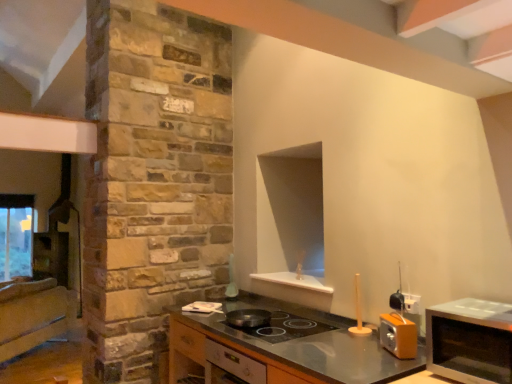
In order to face shiny black frying pan at center, should I rotate leftwards or rightwards?

You should rotate left by 0.945 degrees.

Identify the location of shiny black frying pan at center. This screenshot has width=512, height=384. pyautogui.click(x=248, y=318).

Measure the distance between satin silver stove at center, which ranks as the second cabinetry in back-to-front order, and camera.

satin silver stove at center, which ranks as the second cabinetry in back-to-front order, is 1.95 meters away from camera.

Measure the distance between satin silver microwave at right and camera.

4.40 feet.

Describe the element at coordinates (280, 348) in the screenshot. I see `metallic gray countertop at center` at that location.

What do you see at coordinates (30, 315) in the screenshot?
I see `wooden cabinet at left, the 2th cabinetry viewed from the right` at bounding box center [30, 315].

Find the location of a particular element. This screenshot has height=384, width=512. shiny black frying pan at center is located at coordinates (248, 318).

Is point (461, 317) closer or farther from the camera than point (174, 342)?

Point (461, 317).

Would you say satin silver microwave at right is outside satin silver stove at center, which is the second cabinetry from left to right?

Indeed, satin silver microwave at right is completely outside satin silver stove at center, which is the second cabinetry from left to right.

Which is more to the right, satin silver microwave at right or satin silver stove at center, which ranks as the second cabinetry in back-to-front order?

From the viewer's perspective, satin silver microwave at right appears more on the right side.

Considering the relative sizes of satin silver microwave at right and satin silver stove at center, acting as the first cabinetry starting from the right, in the image provided, is satin silver microwave at right wider than satin silver stove at center, acting as the first cabinetry starting from the right,?

In fact, satin silver microwave at right might be narrower than satin silver stove at center, acting as the first cabinetry starting from the right.

Between wooden cabinet at left, the 2th cabinetry in the front-to-back sequence, and satin silver microwave at right, which one has larger size?

With larger size is wooden cabinet at left, the 2th cabinetry in the front-to-back sequence.

From the image's perspective, is wooden cabinet at left, which ranks as the 1th cabinetry in back-to-front order, on satin silver microwave at right?

Actually, wooden cabinet at left, which ranks as the 1th cabinetry in back-to-front order, appears below satin silver microwave at right in the image.

Considering the sizes of objects wooden cabinet at left, which ranks as the 1th cabinetry in back-to-front order, and satin silver microwave at right in the image provided, who is shorter, wooden cabinet at left, which ranks as the 1th cabinetry in back-to-front order, or satin silver microwave at right?

Standing shorter between the two is satin silver microwave at right.

Which object is closer to the camera taking this photo, wooden cabinet at left, positioned as the first cabinetry in left-to-right order, or satin silver microwave at right?

satin silver microwave at right is closer to the camera.

Which is more to the right, satin silver microwave at right or wooden cabinet at left, the 2th cabinetry viewed from the right?

satin silver microwave at right is more to the right.

Is satin silver microwave at right placed right next to wooden cabinet at left, which ranks as the 1th cabinetry in back-to-front order?

satin silver microwave at right and wooden cabinet at left, which ranks as the 1th cabinetry in back-to-front order, are clearly separated.

From a real-world perspective, which object stands above the other?

satin silver microwave at right is physically above.

Does point (508, 343) come farther from viewer compared to point (25, 330)?

No, (508, 343) is in front of (25, 330).

Which object is wider, metallic gray countertop at center or satin silver stove at center, which ranks as the second cabinetry in back-to-front order?

metallic gray countertop at center is wider.

In the scene shown: Is metallic gray countertop at center taller than satin silver stove at center, acting as the first cabinetry starting from the right?

Correct, metallic gray countertop at center is much taller as satin silver stove at center, acting as the first cabinetry starting from the right.

Is metallic gray countertop at center not inside satin silver stove at center, which ranks as the second cabinetry in back-to-front order?

Absolutely, metallic gray countertop at center is external to satin silver stove at center, which ranks as the second cabinetry in back-to-front order.

How different are the orientations of metallic gray countertop at center and satin silver stove at center, which ranks as the second cabinetry in back-to-front order, in degrees?

They differ by 0.000206 degrees in their facing directions.

Which object is closer to the camera, satin silver microwave at right or metallic gray countertop at center?

satin silver microwave at right is more forward.

Is point (494, 345) farther from viewer compared to point (170, 380)?

No, it is in front of (170, 380).

Between satin silver microwave at right and metallic gray countertop at center, which one has smaller size?

satin silver microwave at right.

Who is taller, satin silver microwave at right or metallic gray countertop at center?

Standing taller between the two is metallic gray countertop at center.

Is shiny black frying pan at center wider or thinner than satin silver stove at center, placed as the 1th cabinetry when sorted from front to back?

Considering their sizes, shiny black frying pan at center looks slimmer than satin silver stove at center, placed as the 1th cabinetry when sorted from front to back.

Which is in front, shiny black frying pan at center or satin silver stove at center, acting as the first cabinetry starting from the right?

satin silver stove at center, acting as the first cabinetry starting from the right, is more forward.

From the image's perspective, is shiny black frying pan at center below satin silver stove at center, placed as the 1th cabinetry when sorted from front to back?

Incorrect, from the image's perspective, shiny black frying pan at center is higher than satin silver stove at center, placed as the 1th cabinetry when sorted from front to back.

In the scene shown: Is shiny black frying pan at center oriented towards satin silver stove at center, acting as the first cabinetry starting from the right?

No.

Which is farther, [207,368] or [51,324]?

The point [51,324] is farther.

In terms of height, does satin silver stove at center, which ranks as the second cabinetry in back-to-front order, look taller or shorter compared to wooden cabinet at left, the 2th cabinetry in the front-to-back sequence?

In the image, satin silver stove at center, which ranks as the second cabinetry in back-to-front order, appears to be shorter than wooden cabinet at left, the 2th cabinetry in the front-to-back sequence.

Which object is further away from the camera taking this photo, satin silver stove at center, acting as the first cabinetry starting from the right, or wooden cabinet at left, positioned as the first cabinetry in left-to-right order?

wooden cabinet at left, positioned as the first cabinetry in left-to-right order, is behind.

Considering the relative sizes of satin silver stove at center, which is the second cabinetry from left to right, and wooden cabinet at left, the 2th cabinetry in the front-to-back sequence, in the image provided, is satin silver stove at center, which is the second cabinetry from left to right, smaller than wooden cabinet at left, the 2th cabinetry in the front-to-back sequence,?

Yes.

This screenshot has height=384, width=512. I want to click on microwave that is on the right side of satin silver stove at center, which ranks as the second cabinetry in back-to-front order, so click(x=470, y=341).

Identify the location of microwave above the wooden cabinet at left, which ranks as the 1th cabinetry in back-to-front order (from a real-world perspective). click(470, 341).

When comparing their distances from shiny black frying pan at center, does satin silver microwave at right or metallic gray countertop at center seem closer?

Based on the image, metallic gray countertop at center appears to be nearer to shiny black frying pan at center.

When comparing their distances from metallic gray countertop at center, does satin silver microwave at right or shiny black frying pan at center seem closer?

Based on the image, shiny black frying pan at center appears to be nearer to metallic gray countertop at center.

From the image, which object appears to be nearer to wooden cabinet at left, which ranks as the 1th cabinetry in back-to-front order, metallic gray countertop at center or satin silver stove at center, which is the second cabinetry from left to right?

satin silver stove at center, which is the second cabinetry from left to right, lies closer to wooden cabinet at left, which ranks as the 1th cabinetry in back-to-front order, than the other object.

From the image, which object appears to be farther from wooden cabinet at left, the 2th cabinetry viewed from the right, satin silver microwave at right or metallic gray countertop at center?

Among the two, satin silver microwave at right is located further to wooden cabinet at left, the 2th cabinetry viewed from the right.

Considering their positions, is metallic gray countertop at center positioned further to satin silver microwave at right than shiny black frying pan at center?

Based on the image, shiny black frying pan at center appears to be further to satin silver microwave at right.

When comparing their distances from wooden cabinet at left, positioned as the first cabinetry in left-to-right order, does shiny black frying pan at center or satin silver stove at center, placed as the 1th cabinetry when sorted from front to back, seem further?

shiny black frying pan at center lies further to wooden cabinet at left, positioned as the first cabinetry in left-to-right order, than the other object.

From the image, which object appears to be nearer to metallic gray countertop at center, wooden cabinet at left, the 2th cabinetry viewed from the right, or satin silver stove at center, acting as the first cabinetry starting from the right?

Among the two, satin silver stove at center, acting as the first cabinetry starting from the right, is located nearer to metallic gray countertop at center.

Estimate the real-world distances between objects in this image. Which object is closer to wooden cabinet at left, which ranks as the 1th cabinetry in back-to-front order, satin silver stove at center, which is the second cabinetry from left to right, or metallic gray countertop at center?

The object closer to wooden cabinet at left, which ranks as the 1th cabinetry in back-to-front order, is satin silver stove at center, which is the second cabinetry from left to right.

I want to click on countertop between wooden cabinet at left, the 2th cabinetry in the front-to-back sequence, and satin silver stove at center, acting as the first cabinetry starting from the right, so click(x=280, y=348).

This screenshot has width=512, height=384. I want to click on frying pan situated between wooden cabinet at left, the 2th cabinetry in the front-to-back sequence, and metallic gray countertop at center from left to right, so click(x=248, y=318).

Locate an element on the screen. cabinetry between wooden cabinet at left, which ranks as the 1th cabinetry in back-to-front order, and satin silver microwave at right from left to right is located at coordinates (226, 351).

You are a GUI agent. You are given a task and a screenshot of the screen. Output one action in this format:
    pyautogui.click(x=<x>, y=<y>)
    Task: Click on the countertop between wooden cabinet at left, the 2th cabinetry viewed from the right, and satin silver microwave at right from left to right
    
    Given the screenshot: What is the action you would take?
    pyautogui.click(x=280, y=348)